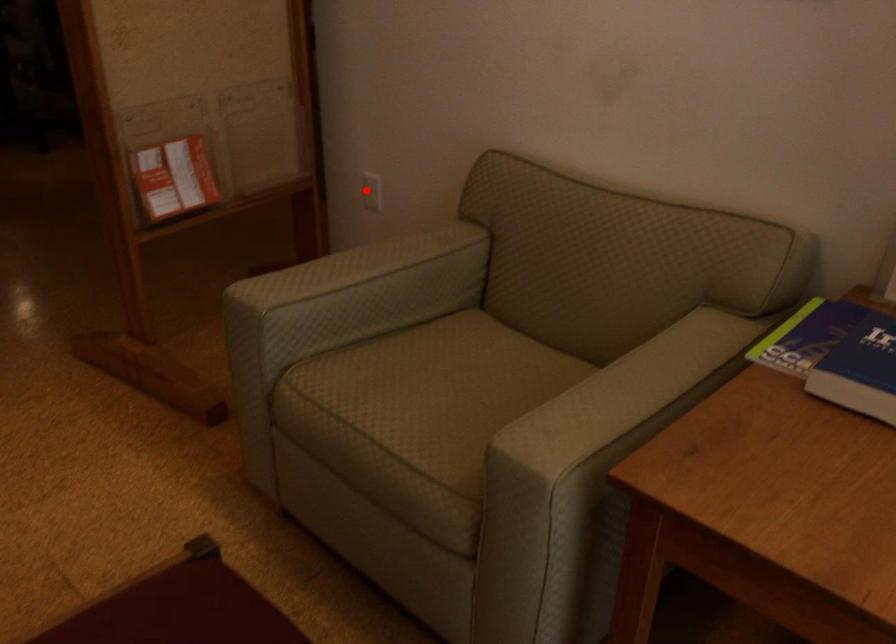
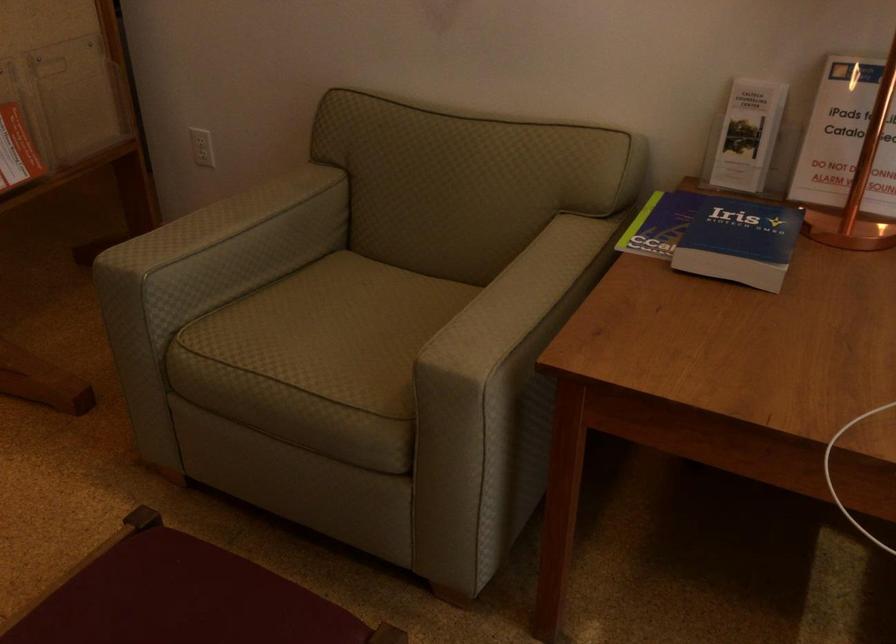
Locate, in the second image, the point that corresponds to the highlighted location in the first image.

(202, 147)